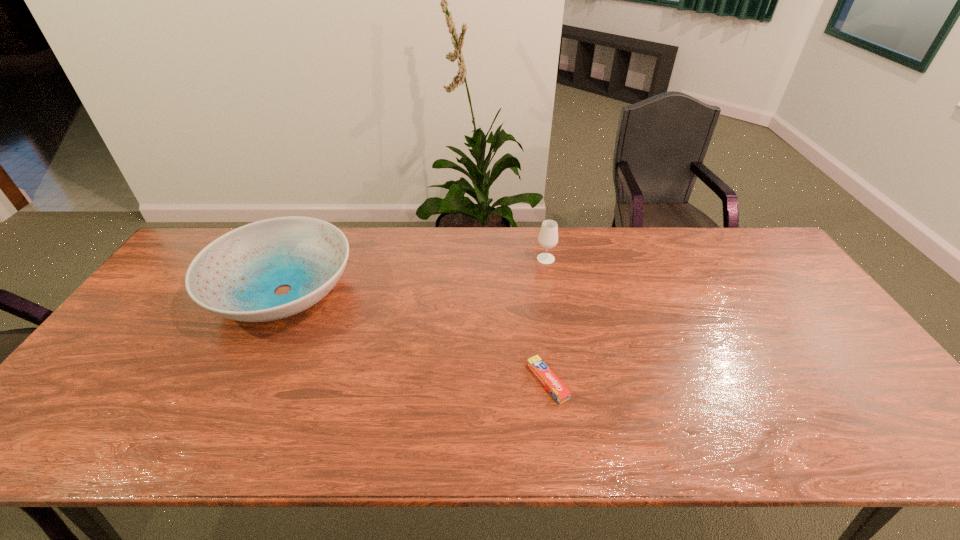
This screenshot has height=540, width=960. In order to click on unoccupied area between the shortest object and the glass in this screenshot , I will do `click(546, 320)`.

The width and height of the screenshot is (960, 540). I want to click on free space between the glass and the dish, so click(x=415, y=275).

Where is `empty space between the nearest object and the glass`? This screenshot has height=540, width=960. empty space between the nearest object and the glass is located at coordinates (546, 320).

Locate an element on the screen. The height and width of the screenshot is (540, 960). vacant area that lies between the toothpaste and the leftmost object is located at coordinates (416, 336).

Identify the location of unoccupied area between the glass and the shortest object. (546, 320).

Where is `object that is the second closest to the glass`? The height and width of the screenshot is (540, 960). object that is the second closest to the glass is located at coordinates (x=235, y=276).

What are the coordinates of `object that is the closest one to the glass` in the screenshot? It's located at (557, 389).

The width and height of the screenshot is (960, 540). Identify the location of vacant space that satisfies the following two spatial constraints: 1. on the back side of the shortest object; 2. on the right side of the glass. (531, 259).

The height and width of the screenshot is (540, 960). Identify the location of free location that satisfies the following two spatial constraints: 1. on the back side of the glass; 2. on the left side of the dish. (299, 259).